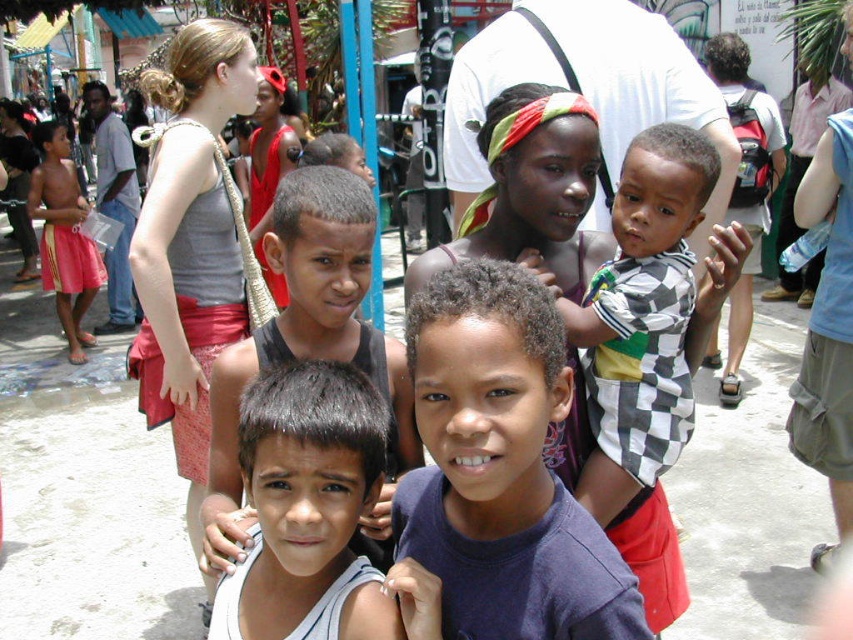
Question: Can you confirm if purple cotton shirt at center is positioned to the left of checkered fabric shirt at center?

Choices:
 (A) yes
 (B) no

Answer: (A)

Question: Which object appears closest to the camera in this image?

Choices:
 (A) purple cotton shirt at center
 (B) dark brown hair at center
 (C) white cotton tank top at center

Answer: (A)

Question: Which object appears farthest from the camera in this image?

Choices:
 (A) white cotton tank top at center
 (B) checkered fabric shirt at center

Answer: (B)

Question: In this image, where is checkered fabric shirt at center located relative to dark brown hair at center?

Choices:
 (A) below
 (B) above

Answer: (A)

Question: Estimate the real-world distances between objects in this image. Which object is closer to the checkered fabric shirt at center?

Choices:
 (A) dark brown hair at center
 (B) white cotton tank top at center
 (C) purple cotton shirt at center

Answer: (A)

Question: Can you confirm if purple cotton shirt at center is thinner than checkered fabric shirt at center?

Choices:
 (A) no
 (B) yes

Answer: (B)